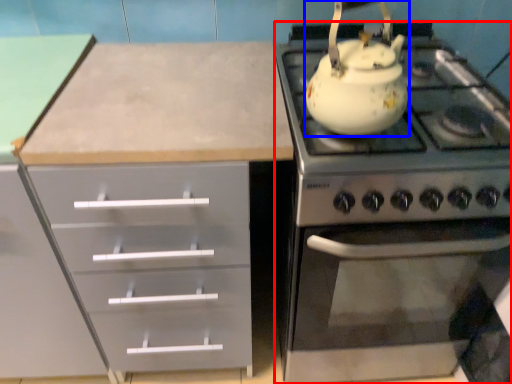
Question: Which object appears closest to the camera in this image, appliance (highlighted by a red box) or kettle (highlighted by a blue box)?

Choices:
 (A) appliance
 (B) kettle

Answer: (B)